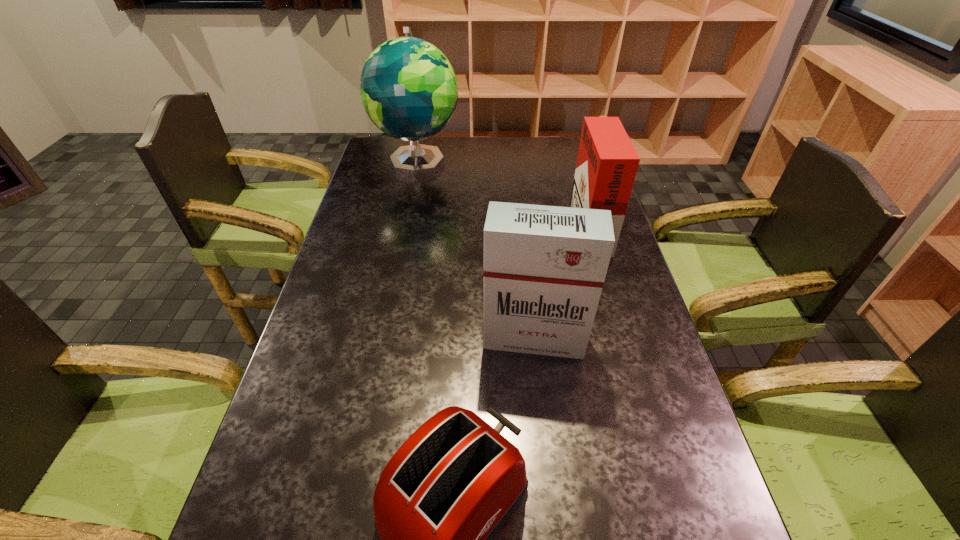
The image size is (960, 540). In order to click on vacant region between the farthest object and the nearer cigarette case in this screenshot , I will do `click(476, 249)`.

You are a GUI agent. You are given a task and a screenshot of the screen. Output one action in this format:
    pyautogui.click(x=<x>, y=<y>)
    Task: Click on the empty location between the second farthest object and the globe
    The height and width of the screenshot is (540, 960).
    Given the screenshot: What is the action you would take?
    pyautogui.click(x=503, y=193)

Identify which object is the third nearest to the right cigarette case. Please provide its 2D coordinates. Your answer should be formatted as a tuple, i.e. [(x, y)], where the tuple contains the x and y coordinates of a point satisfying the conditions above.

[(446, 491)]

What are the coordinates of `the third closest object to the third farthest object` in the screenshot? It's located at (409, 90).

Where is `free space that satisfies the following two spatial constraints: 1. on the front surface of the farthest object; 2. on the left side of the nearer cigarette case`? The width and height of the screenshot is (960, 540). free space that satisfies the following two spatial constraints: 1. on the front surface of the farthest object; 2. on the left side of the nearer cigarette case is located at coordinates (382, 338).

The width and height of the screenshot is (960, 540). Find the location of `vacant region that satisfies the following two spatial constraints: 1. on the front surface of the third farthest object; 2. on the right side of the farthest object`. vacant region that satisfies the following two spatial constraints: 1. on the front surface of the third farthest object; 2. on the right side of the farthest object is located at coordinates (382, 338).